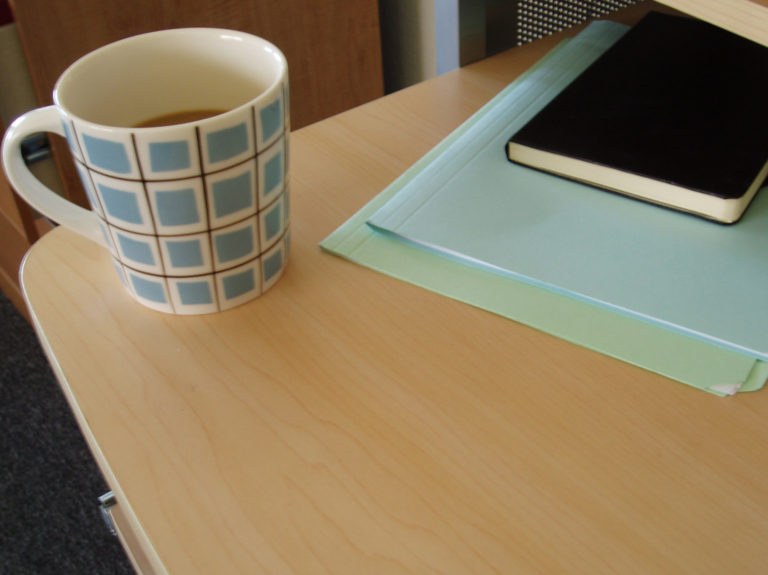
Where is `blue folder`? blue folder is located at coordinates (540, 233).